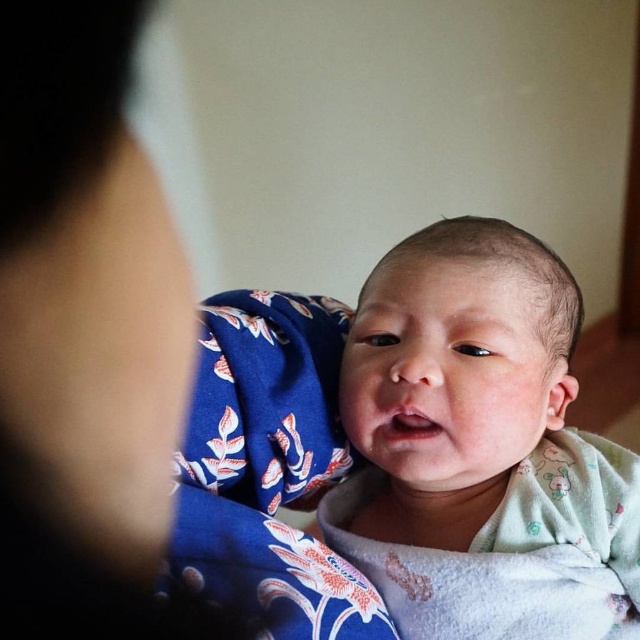
Can you confirm if smooth skin at upper left is positioned above soft white swaddle at center?

Yes, smooth skin at upper left is above soft white swaddle at center.

Who is higher up, smooth skin at upper left or soft white swaddle at center?

smooth skin at upper left is above.

This screenshot has width=640, height=640. What are the coordinates of `smooth skin at upper left` in the screenshot? It's located at (83, 333).

Identify the location of smooth skin at upper left. Image resolution: width=640 pixels, height=640 pixels. (83, 333).